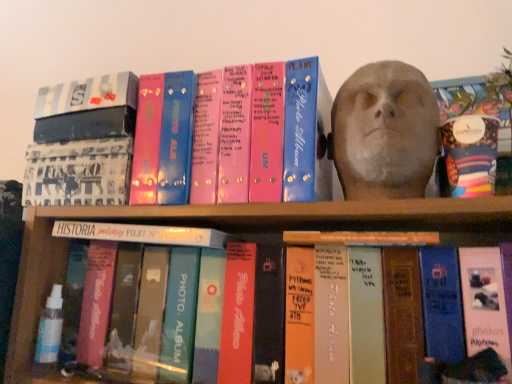
Question: From the image's perspective, is matte gray bust at upper right below white matte book at center, the 1th book from the bottom?

Choices:
 (A) yes
 (B) no

Answer: (B)

Question: Does matte gray bust at upper right appear on the right side of white matte book at center, arranged as the third book when viewed from the top?

Choices:
 (A) no
 (B) yes

Answer: (B)

Question: Does matte gray bust at upper right contain white matte book at center, the 1th book from the bottom?

Choices:
 (A) no
 (B) yes

Answer: (A)

Question: Is matte gray bust at upper right further to camera compared to white matte book at center, the 1th book from the bottom?

Choices:
 (A) no
 (B) yes

Answer: (A)

Question: Is matte gray bust at upper right oriented away from white matte book at center, arranged as the third book when viewed from the top?

Choices:
 (A) yes
 (B) no

Answer: (B)

Question: Considering the positions of pink glossy photo album at upper center, which appears as the first book when viewed from the top, and matte gray bust at upper right in the image, is pink glossy photo album at upper center, which appears as the first book when viewed from the top, wider or thinner than matte gray bust at upper right?

Choices:
 (A) thin
 (B) wide

Answer: (A)

Question: Is pink glossy photo album at upper center, which is counted as the third book, starting from the bottom, situated inside matte gray bust at upper right or outside?

Choices:
 (A) inside
 (B) outside

Answer: (B)

Question: From the image's perspective, relative to matte gray bust at upper right, is pink glossy photo album at upper center, which is counted as the third book, starting from the bottom, above or below?

Choices:
 (A) above
 (B) below

Answer: (B)

Question: From a real-world perspective, is pink glossy photo album at upper center, which is counted as the third book, starting from the bottom, physically located above or below matte gray bust at upper right?

Choices:
 (A) below
 (B) above

Answer: (A)

Question: Is orange matte book at center, the 2th book in the bottom-to-top sequence, inside the boundaries of white matte book at center, arranged as the third book when viewed from the top, or outside?

Choices:
 (A) outside
 (B) inside

Answer: (A)

Question: Looking at their shapes, would you say orange matte book at center, the 2th book in the bottom-to-top sequence, is wider or thinner than white matte book at center, the 1th book from the bottom?

Choices:
 (A) wide
 (B) thin

Answer: (B)

Question: In terms of height, does orange matte book at center, the 2th book in the bottom-to-top sequence, look taller or shorter compared to white matte book at center, arranged as the third book when viewed from the top?

Choices:
 (A) tall
 (B) short

Answer: (B)

Question: From the image's perspective, is orange matte book at center, positioned as the 2th book in top-to-bottom order, positioned above or below white matte book at center, the 1th book from the bottom?

Choices:
 (A) below
 (B) above

Answer: (B)

Question: Considering the positions of point (413, 122) and point (296, 231), is point (413, 122) closer or farther from the camera than point (296, 231)?

Choices:
 (A) closer
 (B) farther

Answer: (A)

Question: Is matte gray bust at upper right to the left or to the right of orange matte book at center, the 2th book in the bottom-to-top sequence, in the image?

Choices:
 (A) right
 (B) left

Answer: (A)